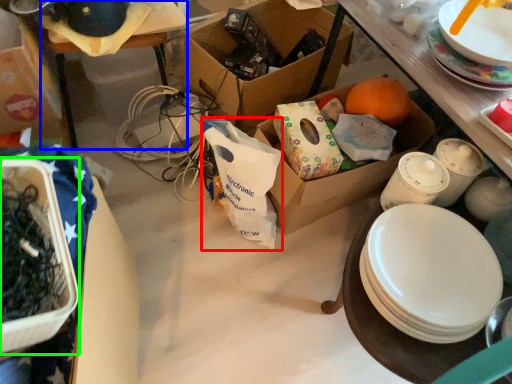
Question: Estimate the real-world distances between objects in this image. Which object is farther from shopping bag (highlighted by a red box), table (highlighted by a blue box) or box (highlighted by a green box)?

Choices:
 (A) table
 (B) box

Answer: (B)